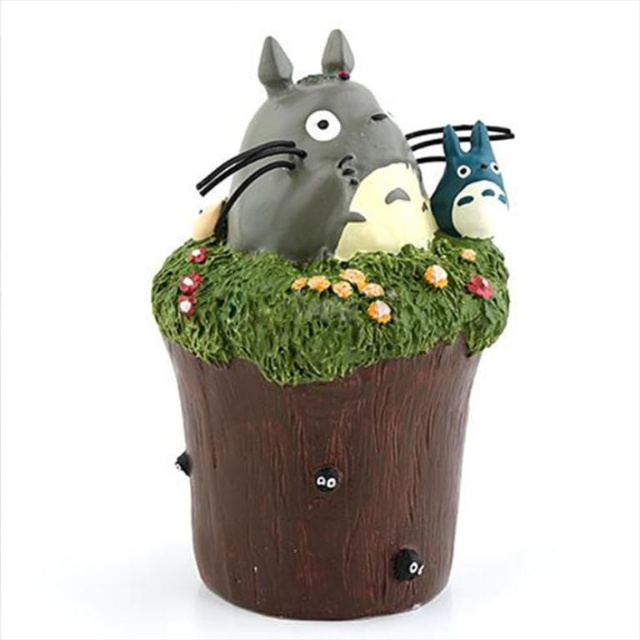
Question: Considering the real-world distances, which object is farthest from the blue matte totoro at center?

Choices:
 (A) matte gray cat at upper center
 (B) green grass at center
 (C) matte brown tree stump at center

Answer: (C)

Question: Which object is farther from the camera taking this photo?

Choices:
 (A) matte gray cat at upper center
 (B) matte brown tree stump at center

Answer: (A)

Question: Does green grass at center have a larger size compared to blue matte totoro at center?

Choices:
 (A) no
 (B) yes

Answer: (B)

Question: Which of the following is the farthest from the observer?

Choices:
 (A) (288, 198)
 (B) (278, 292)

Answer: (A)

Question: Is green grass at center smaller than matte gray cat at upper center?

Choices:
 (A) no
 (B) yes

Answer: (A)

Question: Is matte brown tree stump at center below green grass at center?

Choices:
 (A) yes
 (B) no

Answer: (A)